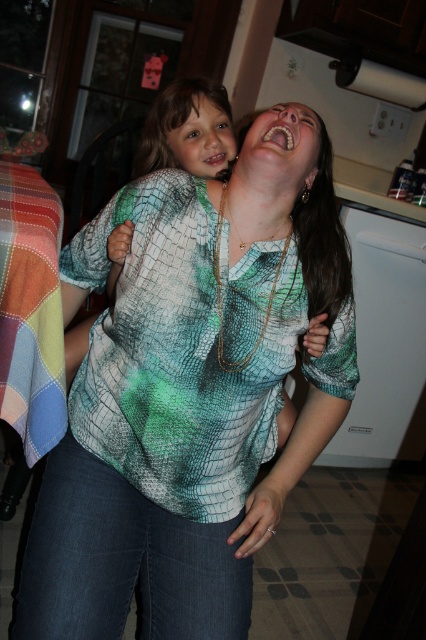
You are standing in the kitchen scene and want to reach the point at coordinates (80, 538). If your arm can extend 36 inches, will you be able to reach it?

The point at coordinates (80, 538) is 37.62 inches away from you, which is slightly beyond your arm reach of 36 inches. Therefore, you cannot reach it with your current arm extension.

You are standing in the kitchen scene. There are two points marked in the image. The first point is at coordinate point (x=173, y=401) and the second is at point (x=163, y=148). From your perspective, which point is closer to you?

Point (x=173, y=401) is in front of point (x=163, y=148), so it is closer to you.